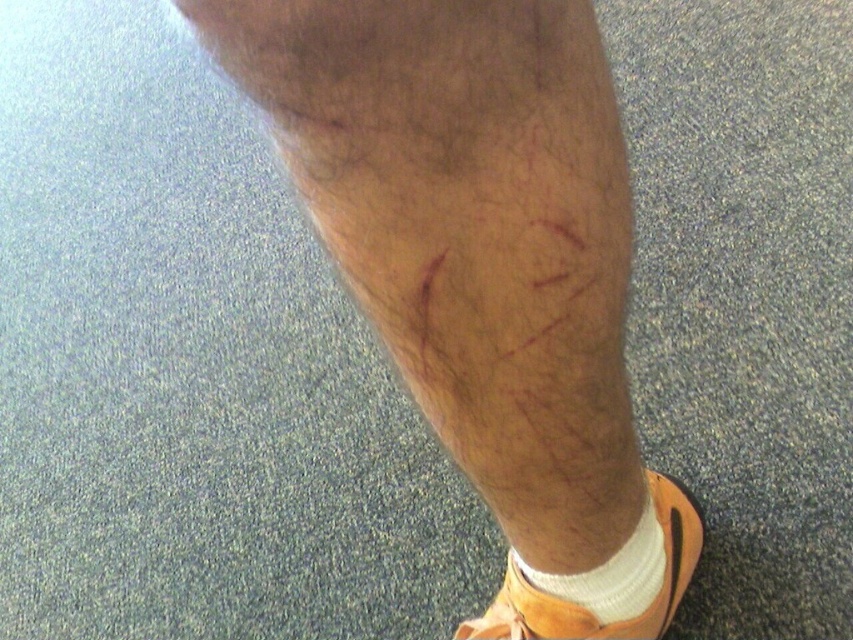
Locate an element on the screen. hair-covered skin at center is located at coordinates (485, 268).

Does hair-covered skin at center appear on the right side of white soft sock at lower right?

Incorrect, hair-covered skin at center is not on the right side of white soft sock at lower right.

Image resolution: width=853 pixels, height=640 pixels. What do you see at coordinates (485, 268) in the screenshot?
I see `hair-covered skin at center` at bounding box center [485, 268].

Where is `hair-covered skin at center`? This screenshot has width=853, height=640. hair-covered skin at center is located at coordinates (485, 268).

Is hair-covered skin at center to the right of orange leather sandal at lower right from the viewer's perspective?

Incorrect, hair-covered skin at center is not on the right side of orange leather sandal at lower right.

Which is below, hair-covered skin at center or orange leather sandal at lower right?

orange leather sandal at lower right

Where is `hair-covered skin at center`? hair-covered skin at center is located at coordinates (485, 268).

Locate an element on the screen. This screenshot has height=640, width=853. hair-covered skin at center is located at coordinates tap(485, 268).

Who is more distant from viewer, [531,593] or [555,596]?

The point [531,593] is more distant.

I want to click on orange leather sandal at lower right, so click(x=585, y=609).